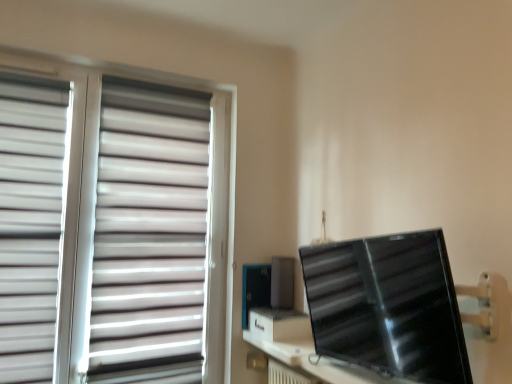
Question: From a real-world perspective, does white matte blinds at left sit lower than black glossy monitor at right?

Choices:
 (A) yes
 (B) no

Answer: (B)

Question: Is white matte blinds at left not close to black glossy monitor at right?

Choices:
 (A) yes
 (B) no

Answer: (A)

Question: Would you say white matte blinds at left is outside black glossy monitor at right?

Choices:
 (A) no
 (B) yes

Answer: (B)

Question: Is white matte blinds at left taller than black glossy monitor at right?

Choices:
 (A) yes
 (B) no

Answer: (A)

Question: Considering the relative sizes of white matte blinds at left and black glossy monitor at right in the image provided, is white matte blinds at left thinner than black glossy monitor at right?

Choices:
 (A) no
 (B) yes

Answer: (B)

Question: Choose the correct answer: Is white matte blinds at left inside black glossy monitor at right or outside it?

Choices:
 (A) outside
 (B) inside

Answer: (A)

Question: From their relative heights in the image, would you say white matte blinds at left is taller or shorter than black glossy monitor at right?

Choices:
 (A) short
 (B) tall

Answer: (B)

Question: Considering the relative positions of white matte blinds at left and black glossy monitor at right in the image provided, is white matte blinds at left to the left or to the right of black glossy monitor at right?

Choices:
 (A) left
 (B) right

Answer: (A)

Question: From a real-world perspective, is white matte blinds at left physically located above or below black glossy monitor at right?

Choices:
 (A) above
 (B) below

Answer: (A)

Question: Is white matte blinds at left, the first curtain viewed from the left, to the left or to the right of white matte blinds at left, which is the 2th curtain in left-to-right order, in the image?

Choices:
 (A) left
 (B) right

Answer: (A)

Question: In terms of width, does white matte blinds at left, the second curtain viewed from the right, look wider or thinner when compared to white matte blinds at left, which is the 2th curtain in left-to-right order?

Choices:
 (A) thin
 (B) wide

Answer: (A)

Question: Considering the positions of white matte blinds at left, the first curtain viewed from the left, and white matte blinds at left, marked as the 1th curtain in a right-to-left arrangement, in the image, is white matte blinds at left, the first curtain viewed from the left, taller or shorter than white matte blinds at left, marked as the 1th curtain in a right-to-left arrangement,?

Choices:
 (A) short
 (B) tall

Answer: (A)

Question: Looking at the image, does white matte blinds at left, the first curtain viewed from the left, seem bigger or smaller compared to white matte blinds at left, which is the 2th curtain in left-to-right order?

Choices:
 (A) big
 (B) small

Answer: (B)

Question: Is point (51, 244) closer or farther from the camera than point (381, 258)?

Choices:
 (A) farther
 (B) closer

Answer: (A)

Question: Is white matte blinds at left, the first curtain viewed from the left, inside or outside of black glossy monitor at right?

Choices:
 (A) inside
 (B) outside

Answer: (B)